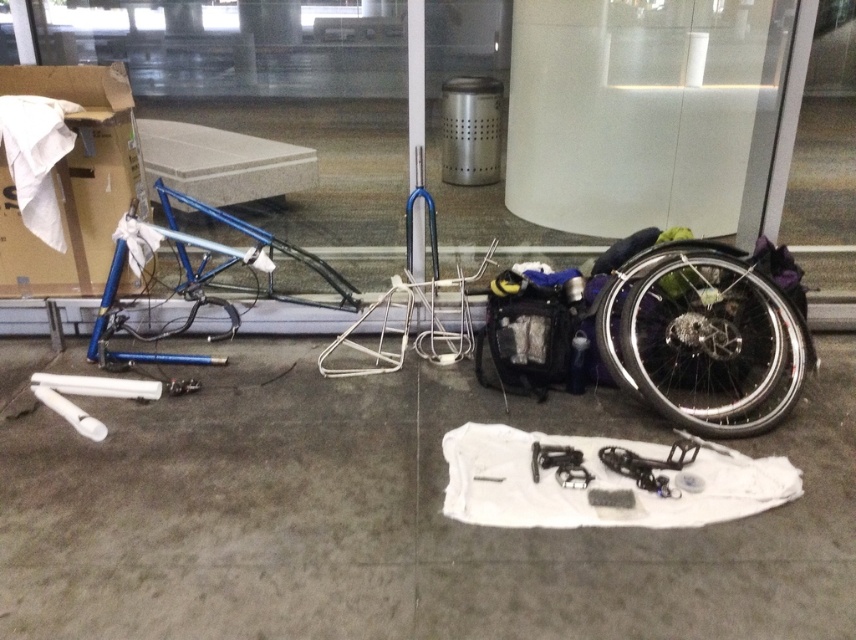
Where is `blue metallic bicycle frame at left`? The height and width of the screenshot is (640, 856). blue metallic bicycle frame at left is located at coordinates (664, 336).

Is blue metallic bicycle frame at left to the right of black metallic wheelchair tire at lower right from the viewer's perspective?

No, blue metallic bicycle frame at left is not to the right of black metallic wheelchair tire at lower right.

I want to click on blue metallic bicycle frame at left, so click(x=664, y=336).

This screenshot has width=856, height=640. In order to click on blue metallic bicycle frame at left in this screenshot , I will do `click(664, 336)`.

In the scene shown: Is blue metallic bicycle frame at left below brown cardboard at upper left?

Yes.

Is blue metallic bicycle frame at left closer to the viewer compared to brown cardboard at upper left?

Yes, it is in front of brown cardboard at upper left.

This screenshot has height=640, width=856. What are the coordinates of `blue metallic bicycle frame at left` in the screenshot? It's located at (664, 336).

Who is positioned more to the right, blue metallic bicycle frame at left or white glossy pillar at center?

blue metallic bicycle frame at left is more to the right.

Is point (348, 288) more distant than point (408, 145)?

No, (348, 288) is in front of (408, 145).

The image size is (856, 640). What are the coordinates of `blue metallic bicycle frame at left` in the screenshot? It's located at (664, 336).